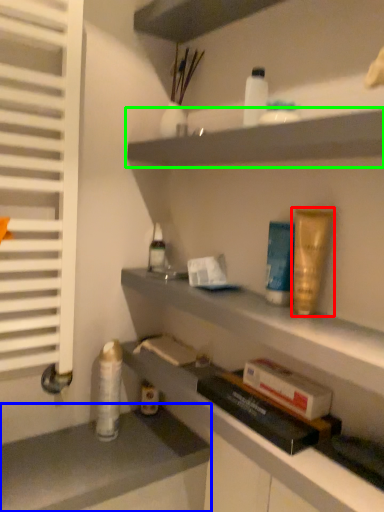
Question: Which object is positioned farthest from toiletry (highlighted by a red box)? Select from counter (highlighted by a blue box) and shelf (highlighted by a green box).

Choices:
 (A) counter
 (B) shelf

Answer: (A)